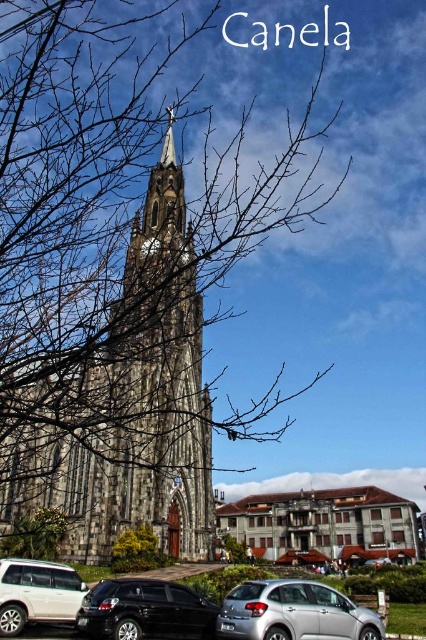
Question: Can you confirm if bare branches at center is positioned to the left of shiny black sedan at lower left?

Choices:
 (A) no
 (B) yes

Answer: (A)

Question: Estimate the real-world distances between objects in this image. Which object is farther from the silver metallic car at lower center?

Choices:
 (A) brown stone church at center
 (B) white matte suv at lower left
 (C) shiny black sedan at lower left

Answer: (A)

Question: Which of the following is the closest to the observer?

Choices:
 (A) (x=207, y=621)
 (B) (x=239, y=596)

Answer: (A)

Question: Can you confirm if bare branches at center is positioned to the right of white matte suv at lower left?

Choices:
 (A) no
 (B) yes

Answer: (B)

Question: Which of the following is the closest to the observer?

Choices:
 (A) (181, 586)
 (B) (74, 616)
 (C) (296, 496)
 (D) (37, 264)

Answer: (B)

Question: Is brown stone church at center wider than silver metallic car at lower center?

Choices:
 (A) no
 (B) yes

Answer: (B)